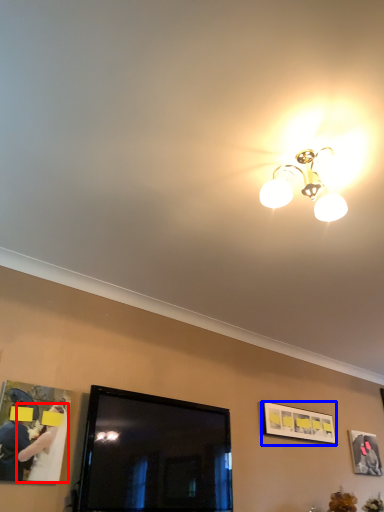
Question: Which object is further to the camera taking this photo, woman (highlighted by a red box) or picture frame (highlighted by a blue box)?

Choices:
 (A) woman
 (B) picture frame

Answer: (B)